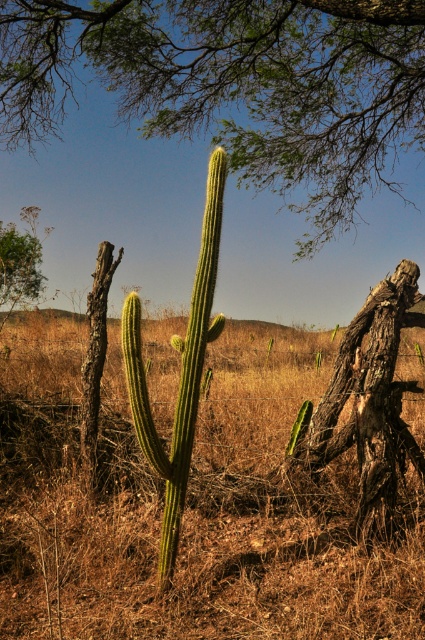
Measure the distance from green dry grass at center to green spiny cactus at center.

green dry grass at center is 2.94 meters from green spiny cactus at center.

Is point (110, 397) positioned before point (200, 326)?

That is False.

Locate an element on the screen. green dry grass at center is located at coordinates (189, 504).

Image resolution: width=425 pixels, height=640 pixels. What are the coordinates of `rough bark tree trunk at right` in the screenshot? It's located at (370, 403).

Which of these two, rough bark tree trunk at right or green spiny cactus at center, stands taller?

green spiny cactus at center

Who is more forward, (357,456) or (163,538)?

Positioned in front is point (163,538).

At what (x,y) coordinates should I click in order to perform the action: click on rough bark tree trunk at right. Please return your answer as a coordinate pair (x, y). This screenshot has width=425, height=640. Looking at the image, I should click on (370, 403).

Is point (51, 83) closer to camera compared to point (221, 324)?

No, (51, 83) is further to viewer.

Which is in front, point (405, 28) or point (141, 424)?

Point (141, 424) is in front.

I want to click on green leafy tree at upper center, so click(235, 83).